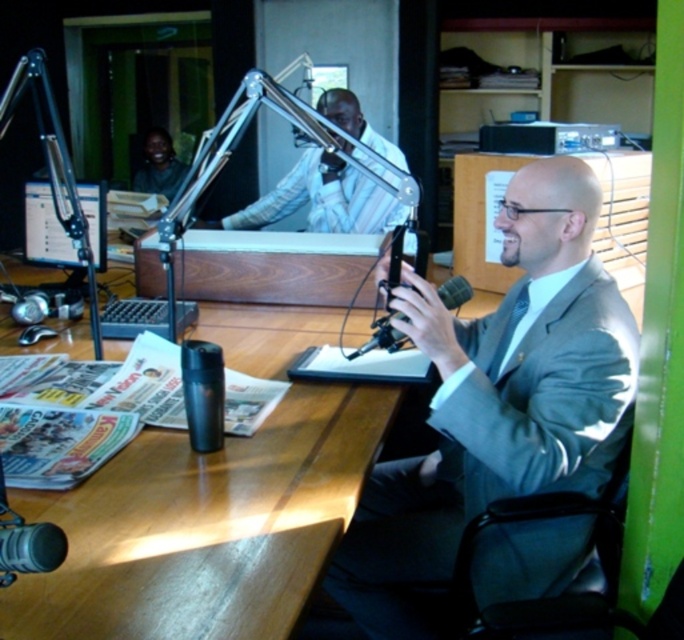
Question: Estimate the real-world distances between objects in this image. Which object is closer to the black matte microphone at center?

Choices:
 (A) matte black monitor at upper left
 (B) wooden table at center

Answer: (B)

Question: Which is nearer to the black matte microphone at center?

Choices:
 (A) matte black monitor at upper left
 (B) gray suit at center

Answer: (B)

Question: Does wooden table at center lie behind white striped shirt at upper center?

Choices:
 (A) yes
 (B) no

Answer: (B)

Question: Does matte black monitor at upper left have a smaller size compared to black matte microphone at center?

Choices:
 (A) no
 (B) yes

Answer: (B)

Question: Which of the following is the closest to the observer?

Choices:
 (A) (389, 316)
 (B) (34, 193)

Answer: (A)

Question: Observing the image, what is the correct spatial positioning of gray suit at center in reference to matte black shirt at upper left?

Choices:
 (A) right
 (B) left

Answer: (A)